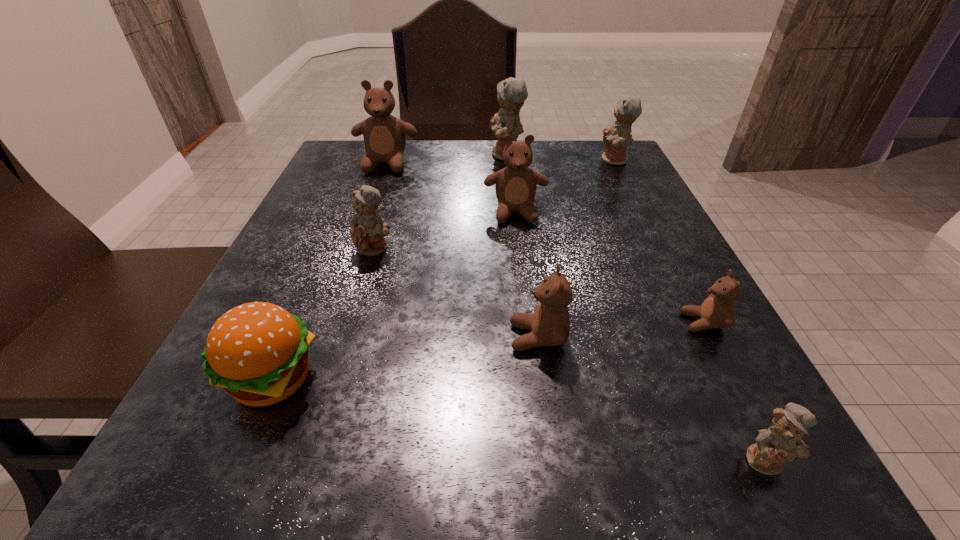
You are a GUI agent. You are given a task and a screenshot of the screen. Output one action in this format:
    pyautogui.click(x=<x>, y=<y>)
    Task: Click on the empty space between the second smallest brown teddy bear and the second biggest blue teddy bear
    This screenshot has width=960, height=540.
    Given the screenshot: What is the action you would take?
    pyautogui.click(x=576, y=249)

The image size is (960, 540). What are the coordinates of `vacant region between the second farthest brown teddy bear and the second biggest blue teddy bear` in the screenshot? It's located at (565, 186).

At what (x,y) coordinates should I click in order to perform the action: click on free point between the third biggest brown teddy bear and the biggest brown teddy bear. Please return your answer as a coordinate pair (x, y). Image resolution: width=960 pixels, height=540 pixels. Looking at the image, I should click on (462, 251).

At what (x,y) coordinates should I click in order to perform the action: click on vacant area that lies between the smallest blue teddy bear and the fifth farthest object. Please return your answer as a coordinate pair (x, y). The width and height of the screenshot is (960, 540). Looking at the image, I should click on (570, 354).

The height and width of the screenshot is (540, 960). Find the location of `vacant area that lies between the hamburger and the fourth farthest teddy bear`. vacant area that lies between the hamburger and the fourth farthest teddy bear is located at coordinates pyautogui.click(x=394, y=295).

Locate an element on the screen. The width and height of the screenshot is (960, 540). empty space between the biggest blue teddy bear and the rightmost brown teddy bear is located at coordinates (605, 239).

The width and height of the screenshot is (960, 540). In order to click on free space that is in between the second biggest blue teddy bear and the leftmost brown teddy bear in this screenshot , I will do `click(500, 163)`.

Image resolution: width=960 pixels, height=540 pixels. I want to click on vacant space that is in between the third biggest brown teddy bear and the fourth farthest teddy bear, so click(527, 275).

Locate which object ranks fourth in proximity to the leftmost brown teddy bear. Please provide its 2D coordinates. Your answer should be formatted as a tuple, i.e. [(x, y)], where the tuple contains the x and y coordinates of a point satisfying the conditions above.

[(616, 138)]

Point out which object is positioned as the second nearest to the second smallest brown teddy bear. Please provide its 2D coordinates. Your answer should be formatted as a tuple, i.e. [(x, y)], where the tuple contains the x and y coordinates of a point satisfying the conditions above.

[(782, 440)]